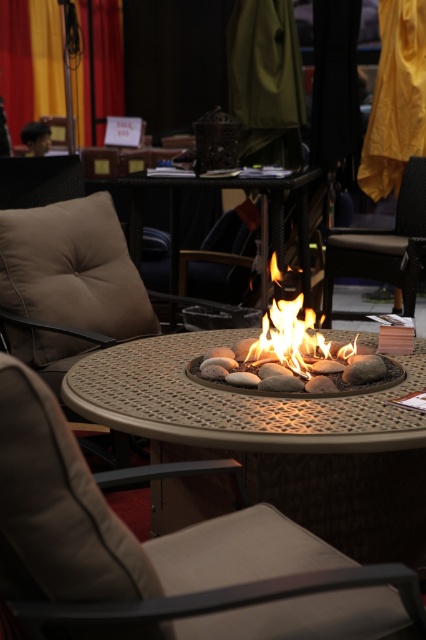
Describe the element at coordinates (169, 554) in the screenshot. The height and width of the screenshot is (640, 426). I see `beige fabric armchair at center` at that location.

Can you confirm if beige fabric armchair at center is taller than metallic fire pit at center?

Incorrect, beige fabric armchair at center's height is not larger of metallic fire pit at center's.

I want to click on beige fabric armchair at center, so click(x=169, y=554).

Is black leather armchair at center above flamematerial/texture at center?

Yes, black leather armchair at center is above flamematerial/texture at center.

Which of these two, black leather armchair at center or flamematerial/texture at center, stands taller?

black leather armchair at center is taller.

What are the coordinates of `black leather armchair at center` in the screenshot? It's located at (382, 246).

Does beige fabric armchair at center appear on the left side of black leather armchair at center?

Yes, beige fabric armchair at center is to the left of black leather armchair at center.

Can you confirm if beige fabric armchair at center is thinner than black leather armchair at center?

In fact, beige fabric armchair at center might be wider than black leather armchair at center.

Is point (13, 568) more distant than point (405, 278)?

No, it is not.

At what (x,y) coordinates should I click in order to perform the action: click on beige fabric armchair at center. Please return your answer as a coordinate pair (x, y). The height and width of the screenshot is (640, 426). Looking at the image, I should click on (169, 554).